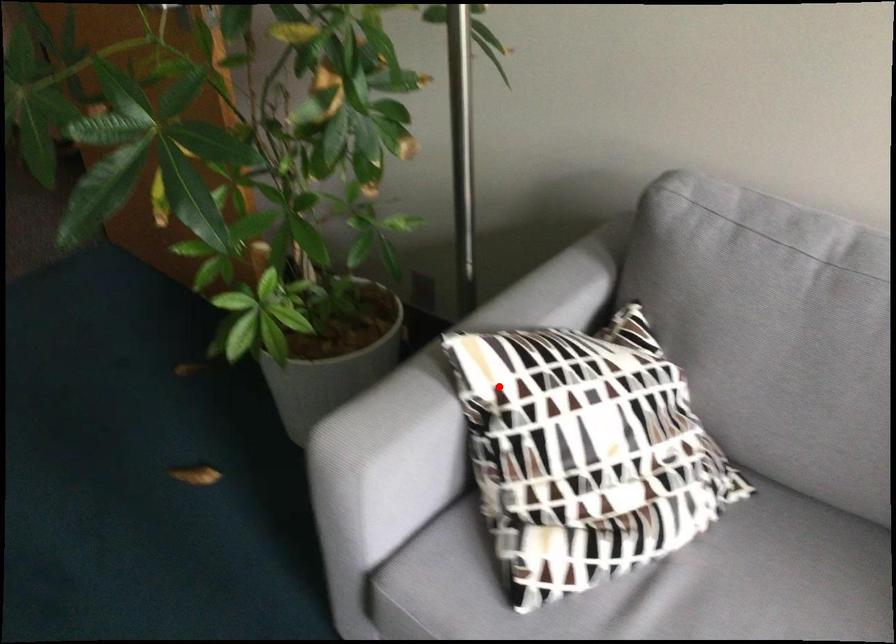
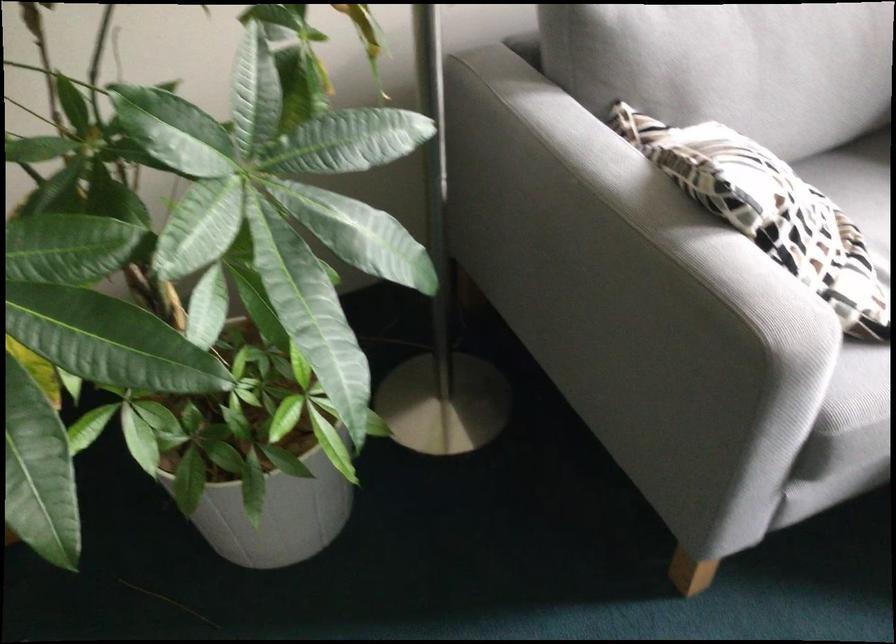
The point at the highlighted location is marked in the first image. Where is the corresponding point in the second image?

(768, 212)